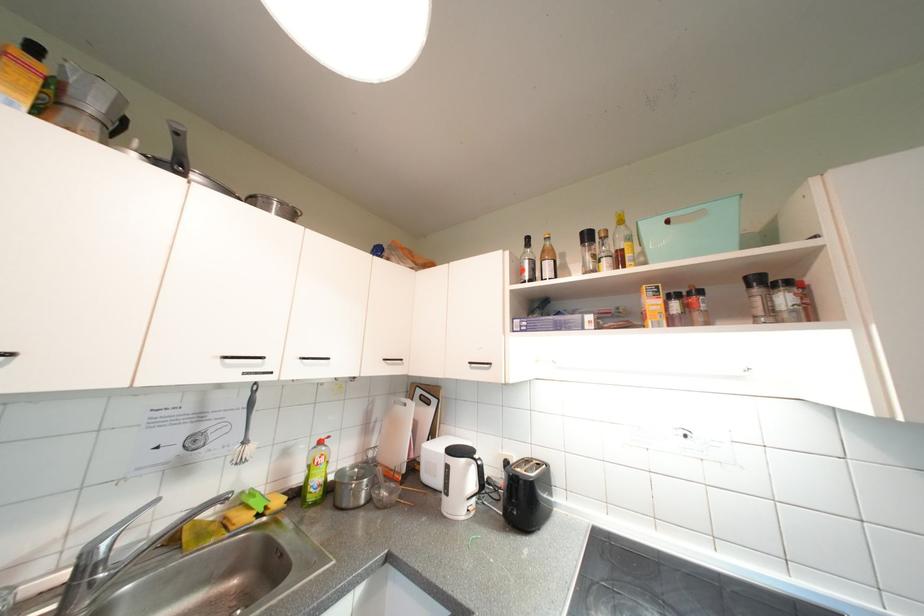
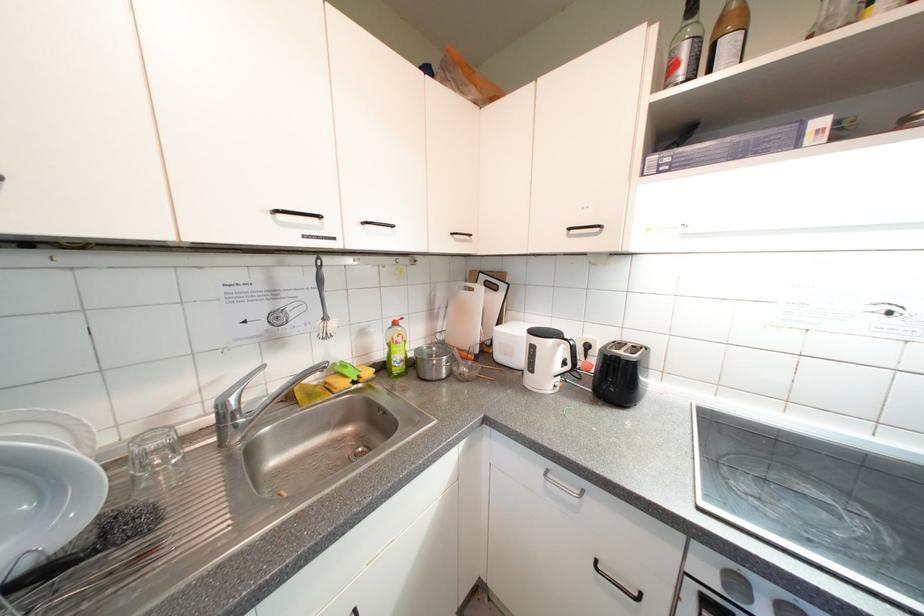
In the second image, find the point that corresponds to (x=311, y=361) in the first image.

(373, 225)